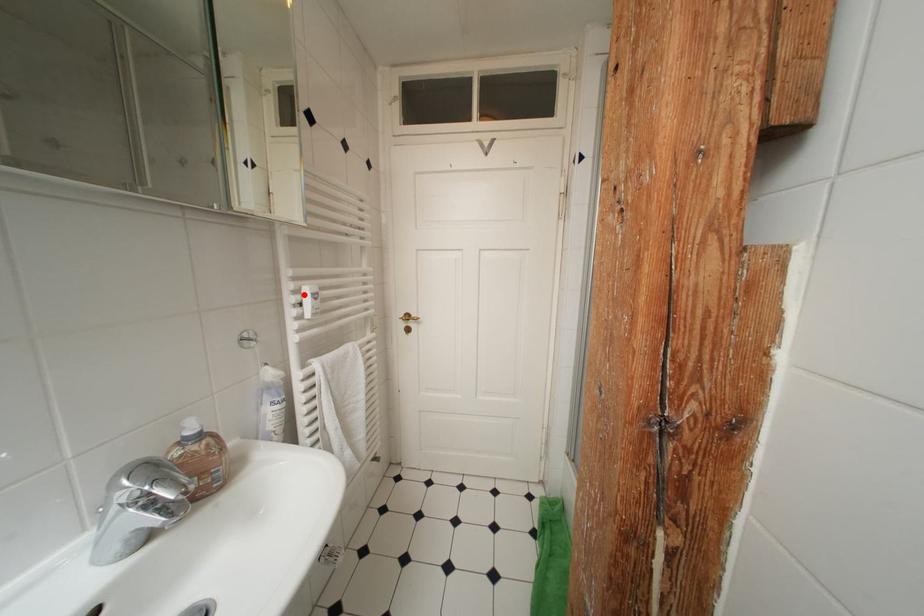
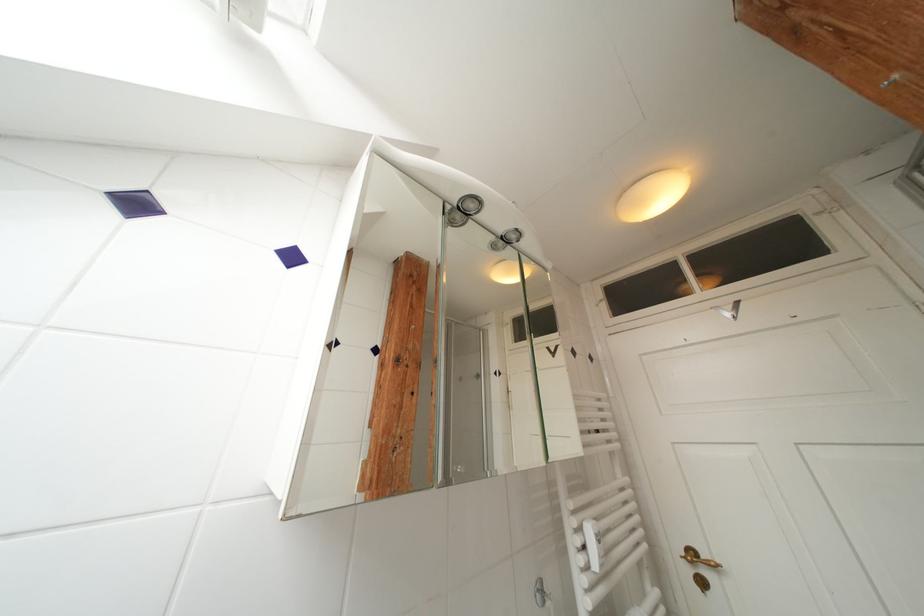
Locate, in the second image, the point that corresponds to the highlighted location in the first image.

(586, 533)